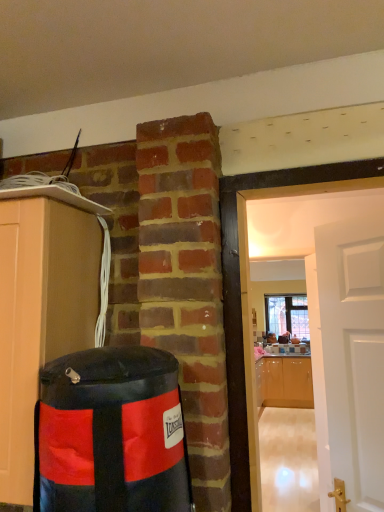
What do you see at coordinates (113, 433) in the screenshot?
I see `black vinyl punching bag at left` at bounding box center [113, 433].

In order to face black vinyl punching bag at left, should I rotate leftwards or rightwards?

To align with it, rotate left about 10.239°.

What do you see at coordinates (44, 307) in the screenshot? The width and height of the screenshot is (384, 512). I see `matte wood cabinet at left, which is counted as the 1th cabinetry, starting from the left` at bounding box center [44, 307].

The image size is (384, 512). I want to click on clear glass window at center, so tap(287, 315).

Find the location of a particular element. The image size is (384, 512). black vinyl punching bag at left is located at coordinates (x=113, y=433).

The width and height of the screenshot is (384, 512). In order to click on the 1st cabinetry behind the black vinyl punching bag at left in this screenshot , I will do `click(44, 307)`.

Is point (18, 402) positioned before point (53, 367)?

No, it is not.

Measure the distance between matte wood cabinet at left, which ranks as the second cabinetry in back-to-front order, and black vinyl punching bag at left.

They are 10.74 inches apart.

From the image's perspective, is matte wood cabinet at left, placed as the second cabinetry when sorted from bottom to top, positioned above or below black vinyl punching bag at left?

Based on their image positions, matte wood cabinet at left, placed as the second cabinetry when sorted from bottom to top, is located above black vinyl punching bag at left.

Considering the positions of objects matte wood cabinet at left, the 1th cabinetry viewed from the top, and glossy wood cabinets at right, which is counted as the first cabinetry, starting from the bottom, in the image provided, who is in front, matte wood cabinet at left, the 1th cabinetry viewed from the top, or glossy wood cabinets at right, which is counted as the first cabinetry, starting from the bottom,?

matte wood cabinet at left, the 1th cabinetry viewed from the top, is closer to the camera.

You are a GUI agent. You are given a task and a screenshot of the screen. Output one action in this format:
    pyautogui.click(x=<x>, y=<y>)
    Task: Click on the cabinetry behind the matte wood cabinet at left, the first cabinetry in the front-to-back sequence
    This screenshot has height=512, width=384.
    Given the screenshot: What is the action you would take?
    pyautogui.click(x=284, y=382)

Between matte wood cabinet at left, the first cabinetry in the front-to-back sequence, and glossy wood cabinets at right, which is counted as the first cabinetry, starting from the bottom, which one has larger width?

With larger width is glossy wood cabinets at right, which is counted as the first cabinetry, starting from the bottom.

Could you tell me if matte wood cabinet at left, the 1th cabinetry viewed from the top, is turned towards glossy wood cabinets at right, which is counted as the first cabinetry, starting from the bottom?

No, matte wood cabinet at left, the 1th cabinetry viewed from the top, is not facing towards glossy wood cabinets at right, which is counted as the first cabinetry, starting from the bottom.

Which of these two, clear glass window at center or matte wood cabinet at left, the 1th cabinetry viewed from the top, stands taller?

Standing taller between the two is clear glass window at center.

Is clear glass window at center inside the boundaries of matte wood cabinet at left, placed as the second cabinetry when sorted from bottom to top, or outside?

clear glass window at center cannot be found inside matte wood cabinet at left, placed as the second cabinetry when sorted from bottom to top.

From the image's perspective, is clear glass window at center below matte wood cabinet at left, the 1th cabinetry viewed from the top?

Yes, from the image's perspective, clear glass window at center is beneath matte wood cabinet at left, the 1th cabinetry viewed from the top.

Does point (275, 296) come closer to viewer compared to point (18, 450)?

No, (275, 296) is behind (18, 450).

From the image's perspective, would you say black vinyl punching bag at left is positioned over clear glass window at center?

Yes, from the image's perspective, black vinyl punching bag at left is over clear glass window at center.

Which is more to the right, black vinyl punching bag at left or clear glass window at center?

Positioned to the right is clear glass window at center.

Is point (137, 422) farther from camera compared to point (307, 316)?

No, it is not.

Considering the positions of objects matte wood cabinet at left, which is counted as the 1th cabinetry, starting from the left, and clear glass window at center in the image provided, who is behind, matte wood cabinet at left, which is counted as the 1th cabinetry, starting from the left, or clear glass window at center?

clear glass window at center is further from the camera.

Which point is more forward, (91, 290) or (305, 322)?

Point (91, 290)

You are a GUI agent. You are given a task and a screenshot of the screen. Output one action in this format:
    pyautogui.click(x=<x>, y=<y>)
    Task: Click on the 2nd cabinetry to the left when counting from the clear glass window at center
    The width and height of the screenshot is (384, 512).
    Given the screenshot: What is the action you would take?
    pyautogui.click(x=44, y=307)

From the image's perspective, would you say matte wood cabinet at left, which is counted as the 1th cabinetry, starting from the left, is positioned over clear glass window at center?

Correct, matte wood cabinet at left, which is counted as the 1th cabinetry, starting from the left, appears higher than clear glass window at center in the image.

Visually, is glossy wood cabinets at right, which ranks as the second cabinetry in top-to-bottom order, positioned to the left or to the right of clear glass window at center?

Based on their positions, glossy wood cabinets at right, which ranks as the second cabinetry in top-to-bottom order, is located to the left of clear glass window at center.

Are glossy wood cabinets at right, which is the first cabinetry from back to front, and clear glass window at center located far from each other?

They are positioned close to each other.

From the image's perspective, which is below, glossy wood cabinets at right, which ranks as the second cabinetry in left-to-right order, or clear glass window at center?

glossy wood cabinets at right, which ranks as the second cabinetry in left-to-right order, is shown below in the image.

From a real-world perspective, is black vinyl punching bag at left physically above glossy wood cabinets at right, which ranks as the second cabinetry in top-to-bottom order?

Yes, from a real-world perspective, black vinyl punching bag at left is above glossy wood cabinets at right, which ranks as the second cabinetry in top-to-bottom order.

Is black vinyl punching bag at left not close to glossy wood cabinets at right, which ranks as the second cabinetry in top-to-bottom order?

Yes, black vinyl punching bag at left is far from glossy wood cabinets at right, which ranks as the second cabinetry in top-to-bottom order.

Is black vinyl punching bag at left situated inside glossy wood cabinets at right, which is the first cabinetry from back to front, or outside?

black vinyl punching bag at left is not enclosed by glossy wood cabinets at right, which is the first cabinetry from back to front.

The image size is (384, 512). Find the location of `cabinetry to the left of black vinyl punching bag at left`. cabinetry to the left of black vinyl punching bag at left is located at coordinates (44, 307).

In order to click on cabinetry located in front of the glossy wood cabinets at right, which ranks as the second cabinetry in left-to-right order in this screenshot , I will do `click(44, 307)`.

From the image, which object appears to be nearer to matte wood cabinet at left, the 2th cabinetry in the right-to-left sequence, clear glass window at center or glossy wood cabinets at right, which is the first cabinetry from back to front?

The object closer to matte wood cabinet at left, the 2th cabinetry in the right-to-left sequence, is glossy wood cabinets at right, which is the first cabinetry from back to front.

Based on their spatial positions, is matte wood cabinet at left, which is counted as the 1th cabinetry, starting from the left, or clear glass window at center further from black vinyl punching bag at left?

The object further to black vinyl punching bag at left is clear glass window at center.

In the scene shown: Estimate the real-world distances between objects in this image. Which object is closer to glossy wood cabinets at right, which ranks as the second cabinetry in left-to-right order, clear glass window at center or black vinyl punching bag at left?

clear glass window at center is positioned closer to the anchor glossy wood cabinets at right, which ranks as the second cabinetry in left-to-right order.

When comparing their distances from clear glass window at center, does glossy wood cabinets at right, which is the first cabinetry from back to front, or matte wood cabinet at left, which is counted as the 1th cabinetry, starting from the left, seem further?

matte wood cabinet at left, which is counted as the 1th cabinetry, starting from the left, lies further to clear glass window at center than the other object.

When comparing their distances from clear glass window at center, does glossy wood cabinets at right, which ranks as the second cabinetry in left-to-right order, or black vinyl punching bag at left seem closer?

The object closer to clear glass window at center is glossy wood cabinets at right, which ranks as the second cabinetry in left-to-right order.

From the image, which object appears to be farther from glossy wood cabinets at right, which is the first cabinetry from back to front, clear glass window at center or matte wood cabinet at left, which is counted as the 1th cabinetry, starting from the left?

matte wood cabinet at left, which is counted as the 1th cabinetry, starting from the left, is further to glossy wood cabinets at right, which is the first cabinetry from back to front.

Based on their spatial positions, is clear glass window at center or glossy wood cabinets at right, which ranks as the second cabinetry in left-to-right order, further from black vinyl punching bag at left?

The object further to black vinyl punching bag at left is clear glass window at center.

Considering their positions, is clear glass window at center positioned further to black vinyl punching bag at left than matte wood cabinet at left, which is counted as the 1th cabinetry, starting from the left?

The object further to black vinyl punching bag at left is clear glass window at center.

I want to click on cabinetry between matte wood cabinet at left, the 1th cabinetry viewed from the top, and clear glass window at center, along the z-axis, so click(x=284, y=382).

Where is `cabinetry between black vinyl punching bag at left and glossy wood cabinets at right, which ranks as the second cabinetry in left-to-right order, from front to back`? The height and width of the screenshot is (512, 384). cabinetry between black vinyl punching bag at left and glossy wood cabinets at right, which ranks as the second cabinetry in left-to-right order, from front to back is located at coordinates (44, 307).